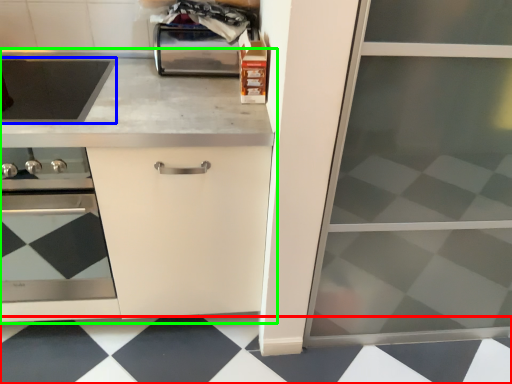
Question: Which object is the closest to the tile (highlighted by a red box)? Choose among these: kitchen appliance (highlighted by a blue box) or countertop (highlighted by a green box).

Choices:
 (A) kitchen appliance
 (B) countertop

Answer: (B)